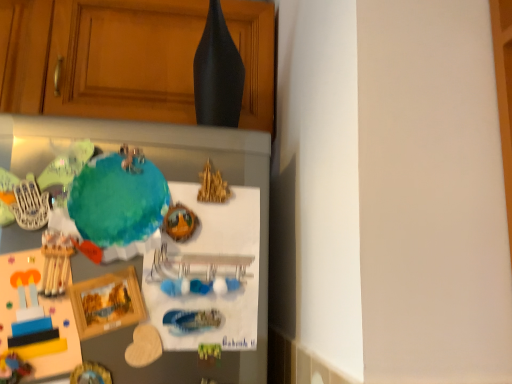
Question: From a real-world perspective, is matte wood cabinet at upper center physically located above or below teal matte globe at center?

Choices:
 (A) above
 (B) below

Answer: (A)

Question: Based on their positions, is matte wood cabinet at upper center located to the left or right of teal matte globe at center?

Choices:
 (A) left
 (B) right

Answer: (A)

Question: Considering the positions of matte wood cabinet at upper center and teal matte globe at center in the image, is matte wood cabinet at upper center taller or shorter than teal matte globe at center?

Choices:
 (A) tall
 (B) short

Answer: (A)

Question: From the image's perspective, is teal matte globe at center positioned above or below matte wood cabinet at upper center?

Choices:
 (A) above
 (B) below

Answer: (B)

Question: Considering the positions of teal matte globe at center and matte wood cabinet at upper center in the image, is teal matte globe at center bigger or smaller than matte wood cabinet at upper center?

Choices:
 (A) big
 (B) small

Answer: (B)

Question: Is point (93, 175) positioned closer to the camera than point (254, 110)?

Choices:
 (A) closer
 (B) farther

Answer: (A)

Question: Considering the positions of teal matte globe at center and matte wood cabinet at upper center in the image, is teal matte globe at center taller or shorter than matte wood cabinet at upper center?

Choices:
 (A) short
 (B) tall

Answer: (A)